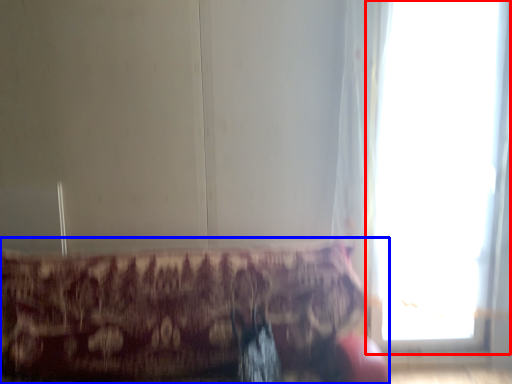
Question: Which of the following is the farthest to the observer, window (highlighted by a red box) or furniture (highlighted by a blue box)?

Choices:
 (A) window
 (B) furniture

Answer: (A)